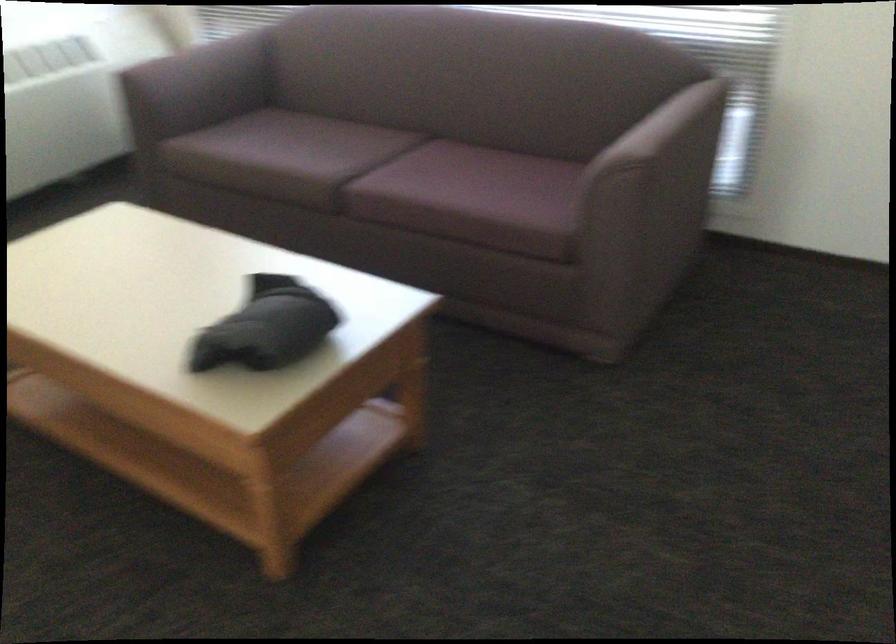
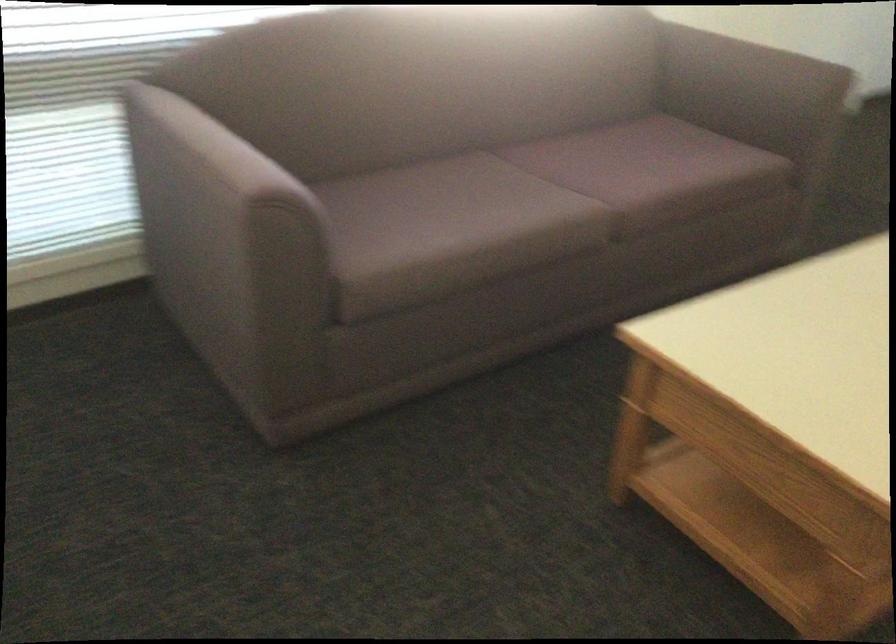
In the second image, find the point that corresponds to [633,140] in the first image.

(746, 73)